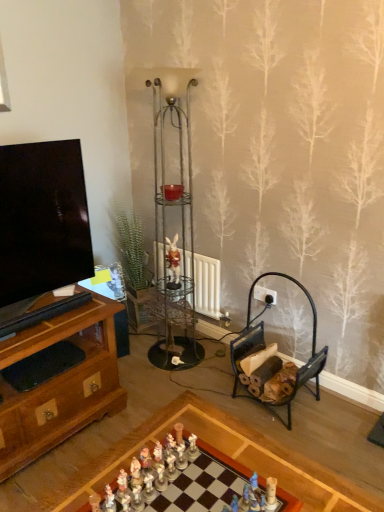
I want to click on empty space that is to the right of shiny silver chess piece at center, marked as the 3th toy in a right-to-left arrangement, so click(x=209, y=480).